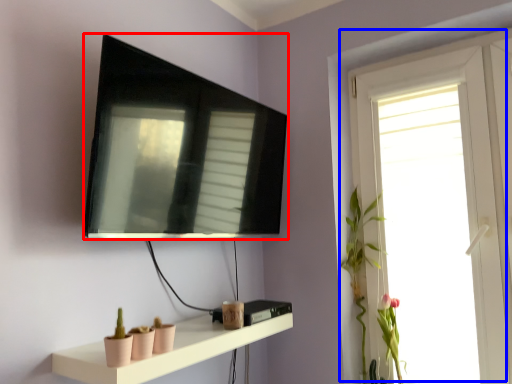
Question: Which object is further to the camera taking this photo, television (highlighted by a red box) or window (highlighted by a blue box)?

Choices:
 (A) television
 (B) window

Answer: (B)